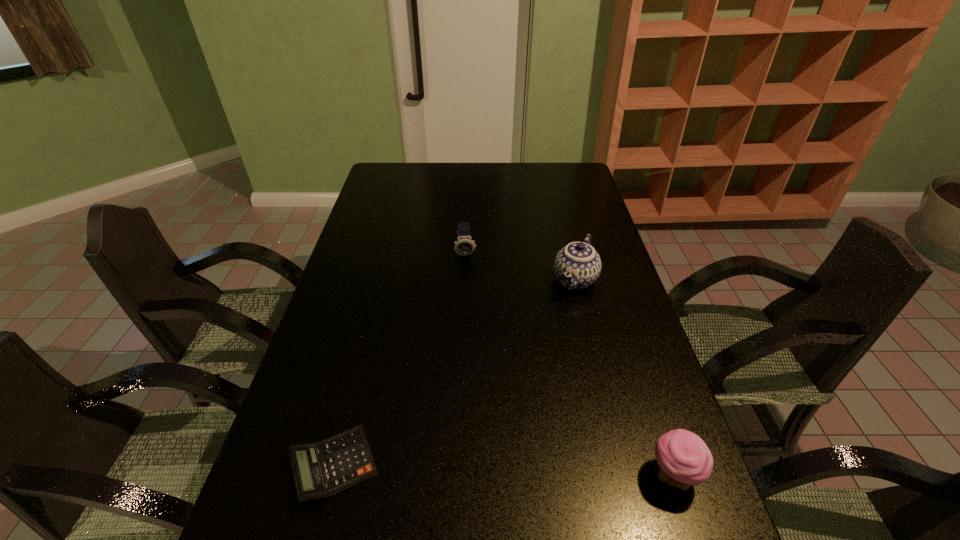
Image resolution: width=960 pixels, height=540 pixels. What are the coordinates of `vacant area in the image that satisfies the following two spatial constraints: 1. on the front side of the cupcake; 2. on the left side of the tallest object` in the screenshot? It's located at (623, 475).

Identify the location of free space in the image that satisfies the following two spatial constraints: 1. on the front side of the watch; 2. on the left side of the tallest object. tap(465, 280).

Image resolution: width=960 pixels, height=540 pixels. Find the location of `vacant point that satisfies the following two spatial constraints: 1. on the back side of the chinaware; 2. on the right side of the shortest object`. vacant point that satisfies the following two spatial constraints: 1. on the back side of the chinaware; 2. on the right side of the shortest object is located at coordinates (381, 280).